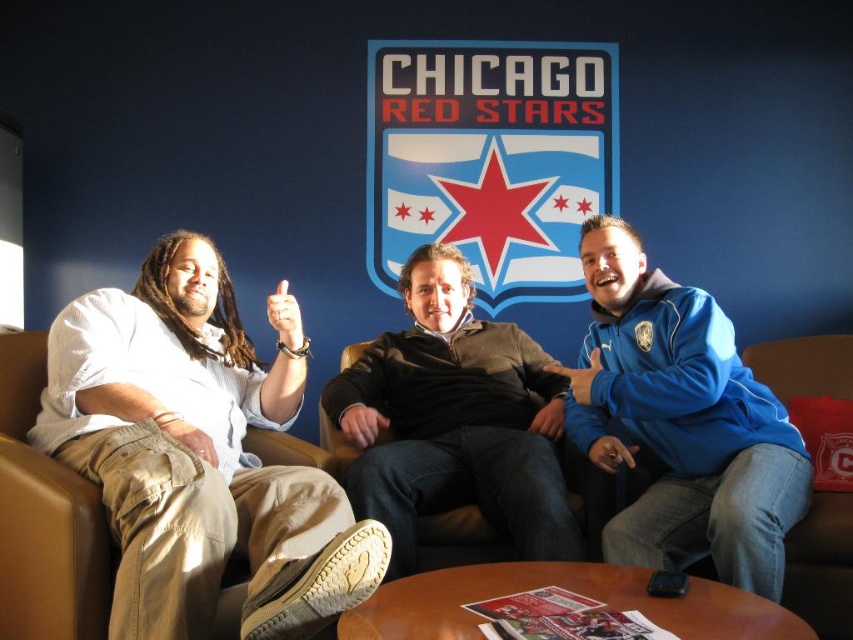
You are a photographer taking a picture of the blue fleece jacket at right and the dark brown sweater at center. You want to ensure both are in focus. Given that your camera has a depth of field that can cover 14 inches, will both items be in focus?

The blue fleece jacket at right is 13.69 inches from the dark brown sweater at center. Since the distance between them is within the camera s 14 inch depth of field, both items will be in focus.

You are standing in front of the Chicago Red Stars logo on the wall. There is a blue fleece jacket at right on the couch. If you want to reach the jacket, which direction should you move your hand relative to the logo?

The blue fleece jacket at right is located at the right side of the couch, so you should move your hand to the right relative to the Chicago Red Stars logo to reach it.

You are standing in front of the Chicago Red Stars logo on the wall. You see two points marked on the wall. The first point is at coordinates point (169, 483) and the second point is at point (54, 554). Which point is closer to you?

Point (169, 483) is in front of point (54, 554), so it is closer to you.